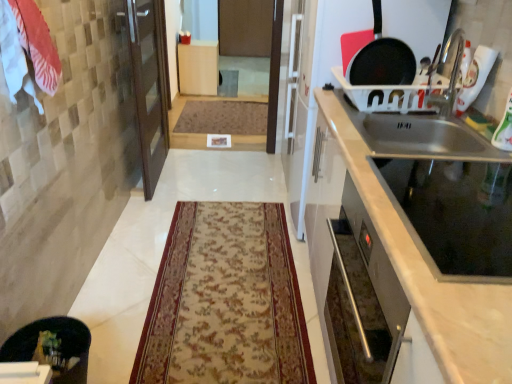
Question: Is black matte frying pan at upper right shorter than beige floral rug at center, which is the 2th mat in top-to-bottom order?

Choices:
 (A) no
 (B) yes

Answer: (A)

Question: Considering the relative sizes of black matte frying pan at upper right and beige floral rug at center, arranged as the 1th mat when ordered from the bottom, in the image provided, is black matte frying pan at upper right wider than beige floral rug at center, arranged as the 1th mat when ordered from the bottom,?

Choices:
 (A) yes
 (B) no

Answer: (B)

Question: Is the position of black matte frying pan at upper right more distant than that of beige floral rug at center, which is the 2th mat in top-to-bottom order?

Choices:
 (A) yes
 (B) no

Answer: (B)

Question: Considering the relative sizes of black matte frying pan at upper right and beige floral rug at center, arranged as the 1th mat when ordered from the bottom, in the image provided, is black matte frying pan at upper right bigger than beige floral rug at center, arranged as the 1th mat when ordered from the bottom,?

Choices:
 (A) yes
 (B) no

Answer: (B)

Question: Could you tell me if black matte frying pan at upper right is turned towards beige floral rug at center, arranged as the 1th mat when ordered from the bottom?

Choices:
 (A) yes
 (B) no

Answer: (B)

Question: Considering the positions of brown textured mat at center, the second mat in the bottom-to-top sequence, and satin silver oven at right, marked as the 2th cabinetry in a top-to-bottom arrangement, in the image, is brown textured mat at center, the second mat in the bottom-to-top sequence, bigger or smaller than satin silver oven at right, marked as the 2th cabinetry in a top-to-bottom arrangement,?

Choices:
 (A) big
 (B) small

Answer: (B)

Question: Considering the positions of brown textured mat at center, marked as the second mat in a front-to-back arrangement, and satin silver oven at right, which is the first cabinetry from right to left, in the image, is brown textured mat at center, marked as the second mat in a front-to-back arrangement, taller or shorter than satin silver oven at right, which is the first cabinetry from right to left,?

Choices:
 (A) tall
 (B) short

Answer: (B)

Question: Is brown textured mat at center, the second mat in the bottom-to-top sequence, wider or thinner than satin silver oven at right, which is counted as the second cabinetry, starting from the left?

Choices:
 (A) thin
 (B) wide

Answer: (B)

Question: In the image, is brown textured mat at center, which ranks as the first mat in top-to-bottom order, positioned in front of or behind satin silver oven at right, which is the 1th cabinetry in front-to-back order?

Choices:
 (A) front
 (B) behind

Answer: (B)

Question: Is white cotton towel at upper left wider or thinner than black matte frying pan at upper right?

Choices:
 (A) thin
 (B) wide

Answer: (B)

Question: Considering the positions of white cotton towel at upper left and black matte frying pan at upper right in the image, is white cotton towel at upper left taller or shorter than black matte frying pan at upper right?

Choices:
 (A) short
 (B) tall

Answer: (A)

Question: Considering the positions of white cotton towel at upper left and black matte frying pan at upper right in the image, is white cotton towel at upper left bigger or smaller than black matte frying pan at upper right?

Choices:
 (A) small
 (B) big

Answer: (B)

Question: In the image, is white cotton towel at upper left positioned in front of or behind black matte frying pan at upper right?

Choices:
 (A) front
 (B) behind

Answer: (A)

Question: Does point (261, 329) appear closer or farther from the camera than point (39, 36)?

Choices:
 (A) farther
 (B) closer

Answer: (A)

Question: In terms of width, does beige floral rug at center, which is the 2th mat in top-to-bottom order, look wider or thinner when compared to white cotton towel at upper left?

Choices:
 (A) thin
 (B) wide

Answer: (B)